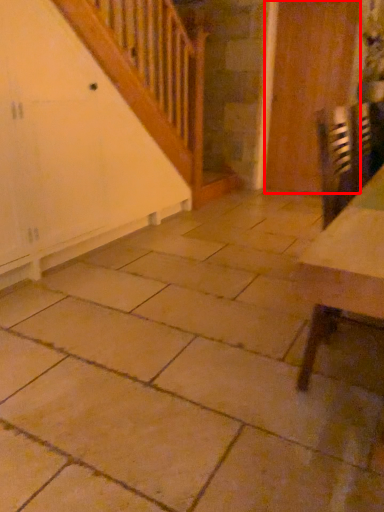
Question: In this image, where is door (annotated by the red box) located relative to table?

Choices:
 (A) left
 (B) right

Answer: (B)